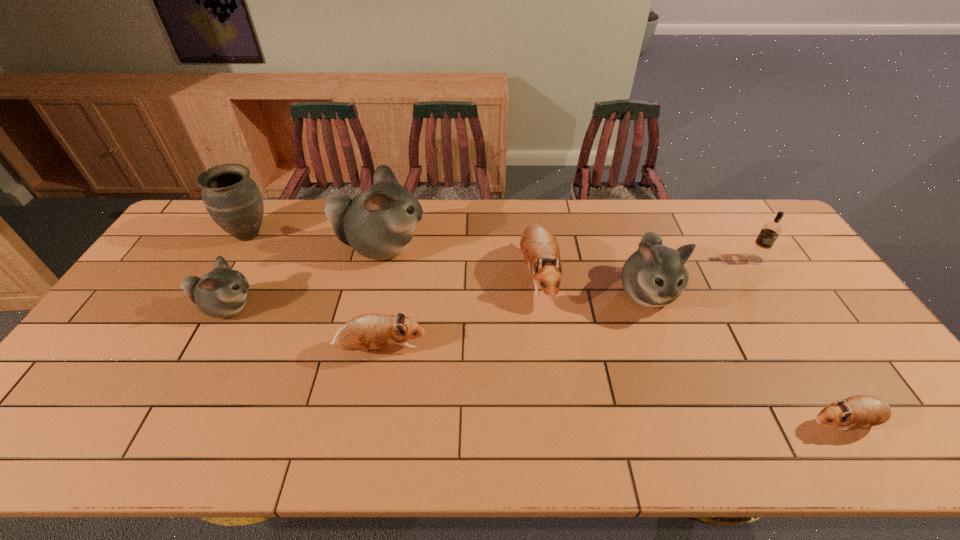
The width and height of the screenshot is (960, 540). In order to click on object at the far left corner in this screenshot , I will do `click(233, 200)`.

Where is `object that is at the near right corner`? object that is at the near right corner is located at coordinates (862, 410).

Find the location of a particular element. This screenshot has width=960, height=540. blank space at the far edge is located at coordinates (708, 237).

Image resolution: width=960 pixels, height=540 pixels. Identify the location of vacant space at the near edge of the desktop. (353, 429).

This screenshot has width=960, height=540. I want to click on vacant area at the left edge of the desktop, so click(x=157, y=325).

The image size is (960, 540). In the image, there is a desktop. Identify the location of free space at the right edge. (777, 279).

Find the location of `free region at the far right corner of the desktop`. free region at the far right corner of the desktop is located at coordinates (732, 202).

Find the location of a particular element. The height and width of the screenshot is (540, 960). free space that is in between the vodka and the second biggest brown hamster is located at coordinates (567, 304).

I want to click on empty space between the sixth object from left to right and the fifth object from left to right, so click(x=592, y=284).

Identify the location of empty location between the seventh farthest object and the second white hamster from right to left. (381, 299).